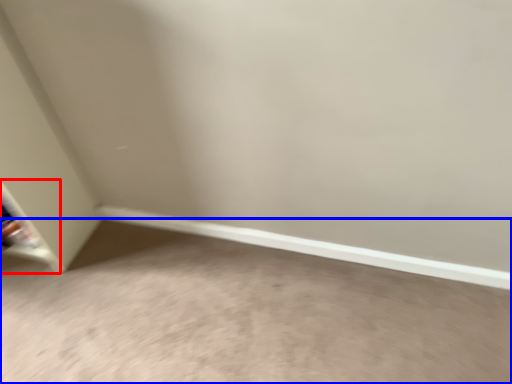
Question: Among these objects, which one is farthest to the camera, shelf (highlighted by a red box) or concrete (highlighted by a blue box)?

Choices:
 (A) shelf
 (B) concrete

Answer: (A)